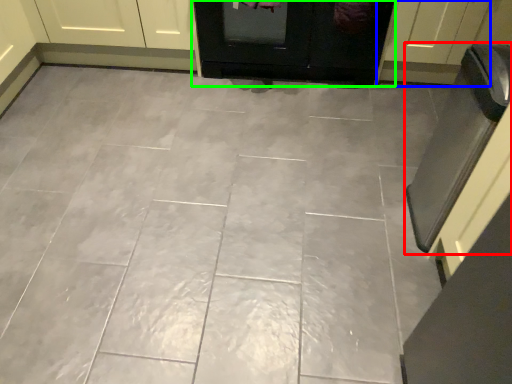
Question: Which object is the closest to the oven (highlighted by a red box)? Choose among these: door (highlighted by a blue box) or door (highlighted by a green box).

Choices:
 (A) door
 (B) door

Answer: (A)